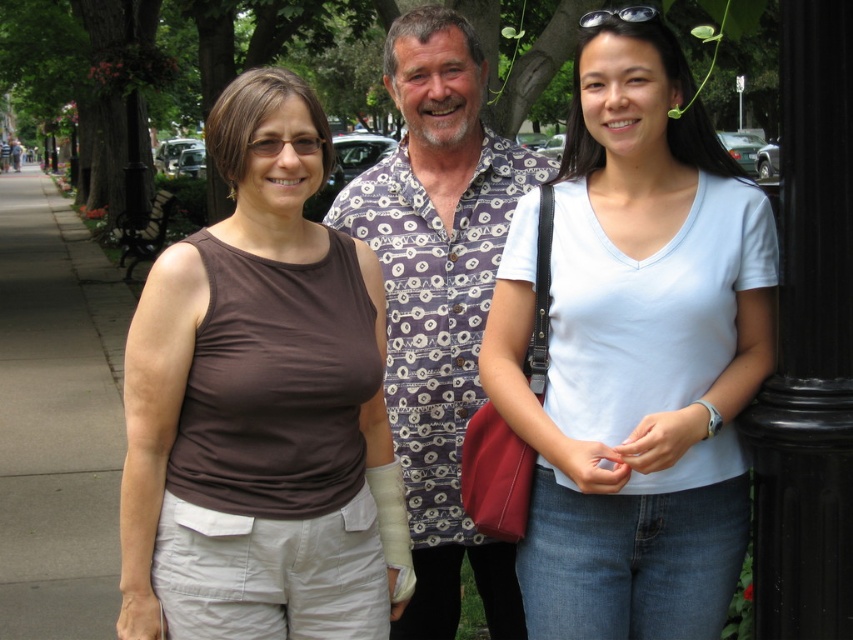
Question: Which point is farther from the camera taking this photo?

Choices:
 (A) (456, 125)
 (B) (610, 340)
 (C) (639, 19)
 (D) (248, 288)

Answer: (A)

Question: Is patterned fabric shirt at center smaller than gray concrete sidewalk at left?

Choices:
 (A) yes
 (B) no

Answer: (A)

Question: In this image, where is brown matte tank top at center located relative to gray concrete sidewalk at left?

Choices:
 (A) right
 (B) left

Answer: (A)

Question: Does light blue cotton shirt at center have a larger size compared to gray concrete sidewalk at left?

Choices:
 (A) yes
 (B) no

Answer: (B)

Question: Which of these objects is positioned closest to the gray concrete sidewalk at left?

Choices:
 (A) light blue cotton shirt at center
 (B) brown matte tank top at center
 (C) patterned fabric shirt at center
 (D) black plastic goggles at upper center

Answer: (B)

Question: Which point is farther to the camera?

Choices:
 (A) (590, 13)
 (B) (479, 96)

Answer: (B)